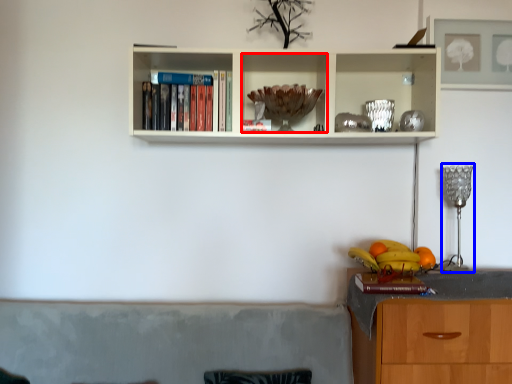
Question: Which object is further to the camera taking this photo, cabinet (highlighted by a red box) or lamp (highlighted by a blue box)?

Choices:
 (A) cabinet
 (B) lamp

Answer: (B)